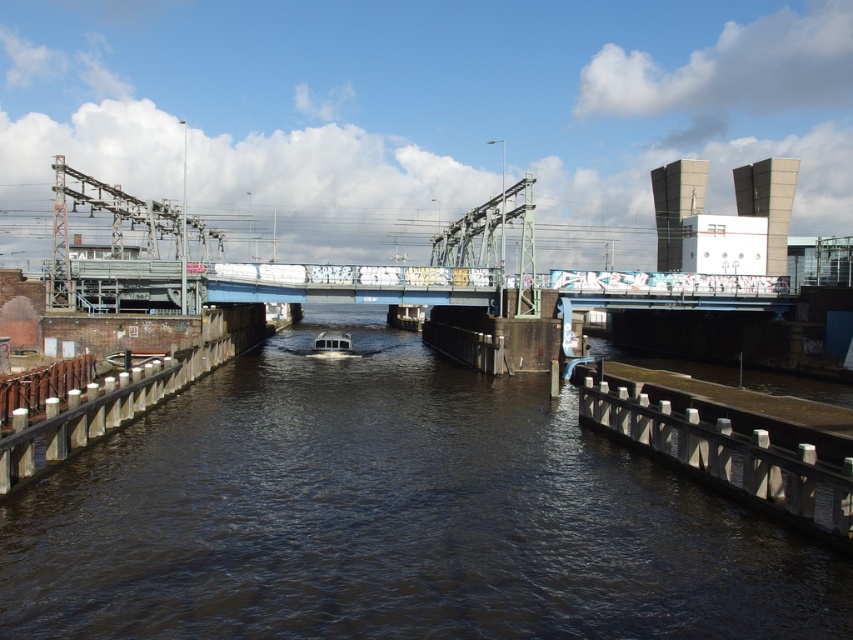
You are a delivery drone that needs to land on the wooden dock at left. The drone has a wingspan of 5 meters. Can you safely land on the dock without touching the dark brown water at center?

The distance between the dark brown water at center and the wooden dock at left is 6.22 meters. Since the drone has a wingspan of 5 meters, which is less than the 6.22 meters gap, it can safely land on the wooden dock at left without touching the dark brown water at center.

You are standing on the metallic gray dock at lower right and want to reach the dark brown water at center. Can you step directly into the water from your current position?

The dark brown water at center is above the metallic gray dock at lower right, meaning the dock is below the water level. Therefore, stepping directly into the water from the dock would require descending or jumping down since the dock is lower.

In the scene shown: You are a delivery drone operator. Your drone has a maximum flight range of 30 feet. You need to deliver a package from the bridge to the dark brown water at center. Can your drone make the trip without needing a recharge?

The distance between the bridge and the dark brown water at center is 32.61 feet, which exceeds the drone operator mentioned maximum flight range of 30 feet. Therefore, the drone cannot make the trip without needing a recharge.